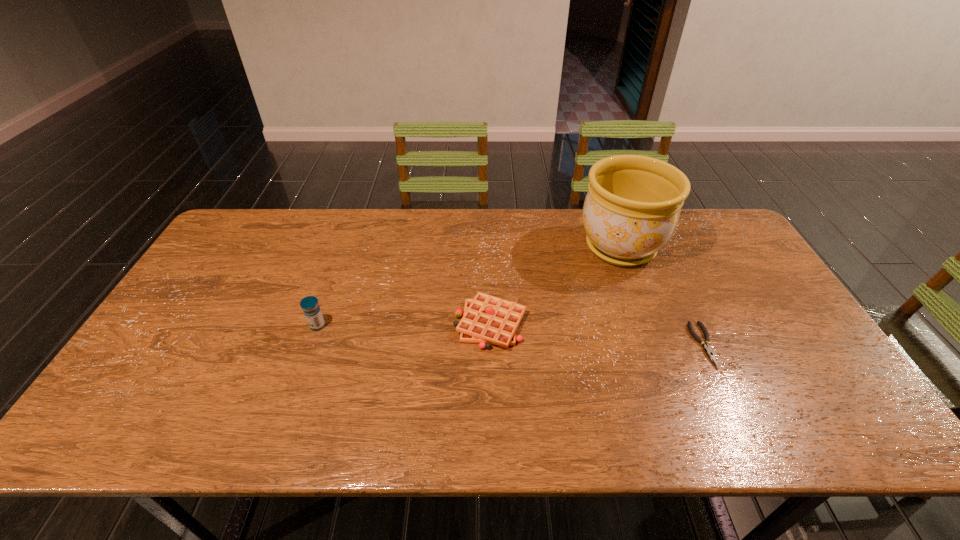
At what (x,y) coordinates should I click in order to perform the action: click on vacant space that's between the second shortest object and the flowerpot. Please return your answer as a coordinate pair (x, y). This screenshot has width=960, height=540. Looking at the image, I should click on (555, 286).

The image size is (960, 540). Identify the location of free spot between the medicine and the third object from right to left. (404, 325).

Where is `free point between the medicine and the second shortest object`? The image size is (960, 540). free point between the medicine and the second shortest object is located at coordinates (404, 325).

Where is `empty location between the medicine and the second shortest object`? empty location between the medicine and the second shortest object is located at coordinates (404, 325).

Locate an element on the screen. The image size is (960, 540). vacant area that lies between the pliers and the farthest object is located at coordinates [662, 296].

Where is `free area in between the pliers and the tallest object`? free area in between the pliers and the tallest object is located at coordinates (662, 296).

The width and height of the screenshot is (960, 540). I want to click on object that stands as the closest to the leftmost object, so click(487, 319).

Locate an element on the screen. The height and width of the screenshot is (540, 960). object that stands as the closest to the medicine is located at coordinates (487, 319).

The width and height of the screenshot is (960, 540). Identify the location of free space that satisfies the following two spatial constraints: 1. on the back side of the medicine; 2. on the right side of the waffle. (318, 323).